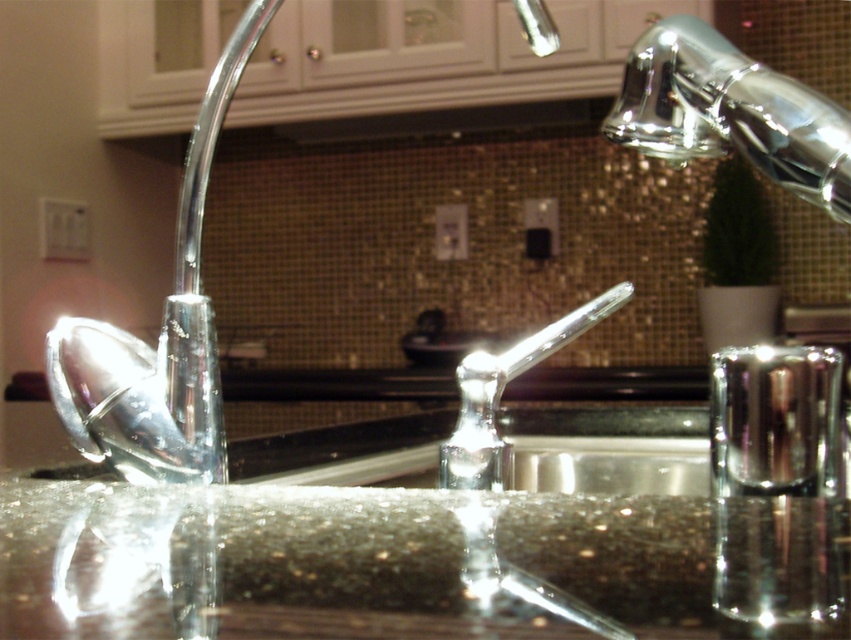
You are a kitchen designer and need to install a new faucet. You have two options in the image. The first is the chrome metallic faucet at upper right, and the second is the polished chrome faucet at center. If you want to place them side by side on the counter, will they fit within a 12 inch space?

The chrome metallic faucet at upper right is 6.63 inches from polished chrome faucet at center, so placing them side by side within a 12 inch space would be possible as the total distance between them is less than 12 inches.

You are standing in the kitchen sink area and want to place a small decorative item between the two points, point (758, 589) and point (618, 115). Which point should you place it closer to if you want it to be closer to the front of the scene?

You should place the decorative item closer to point (758, 589) because it is in front of point (618, 115), making it closer to the front of the scene.

You are a kitchen designer and need to install a new faucet. The current shiny granite sink at center is positioned on the left side of the polished chrome faucet at center. Where should you place the new faucet relative to the sink?

The shiny granite sink at center is positioned on the left side of the polished chrome faucet at center, so the new faucet should be placed to the right of the shiny granite sink at center to maintain the same layout.